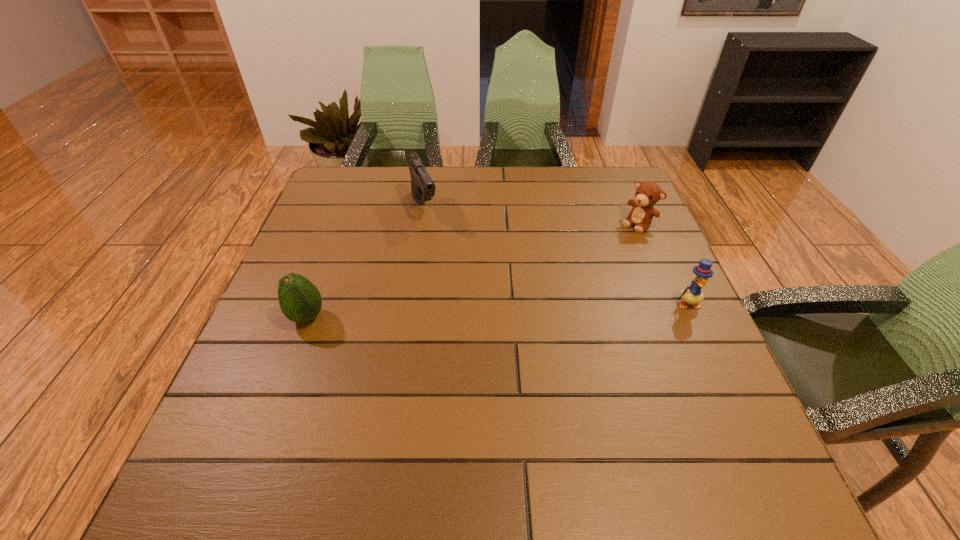
You are a GUI agent. You are given a task and a screenshot of the screen. Output one action in this format:
    pyautogui.click(x=<x>, y=<y>)
    Task: Click on the vacant space on the desktop that is between the leftmost object and the duckling and is positioned on the face of the teddy bear
    
    Given the screenshot: What is the action you would take?
    pyautogui.click(x=539, y=309)

The image size is (960, 540). In order to click on free space on the desktop that is between the leftmost object and the duckling and is positioned at the barrel of the pistol in this screenshot , I will do `click(476, 312)`.